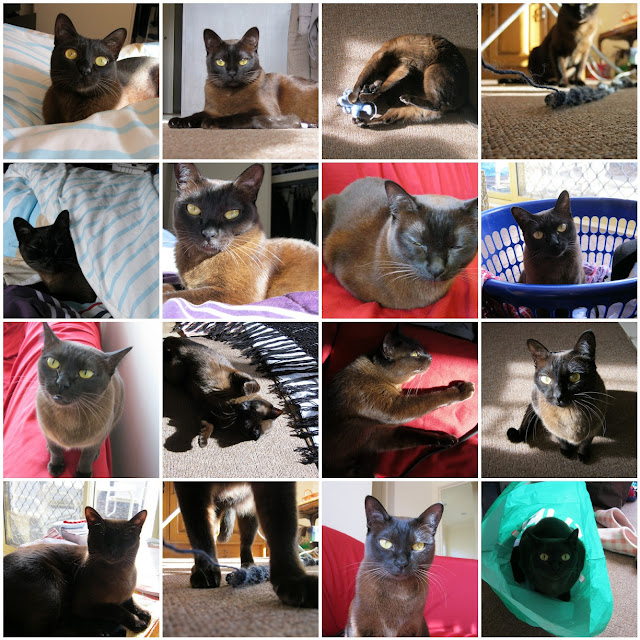
Locate an element on the screen. Image resolution: width=640 pixels, height=640 pixels. couch cover is located at coordinates (436, 569), (16, 399).